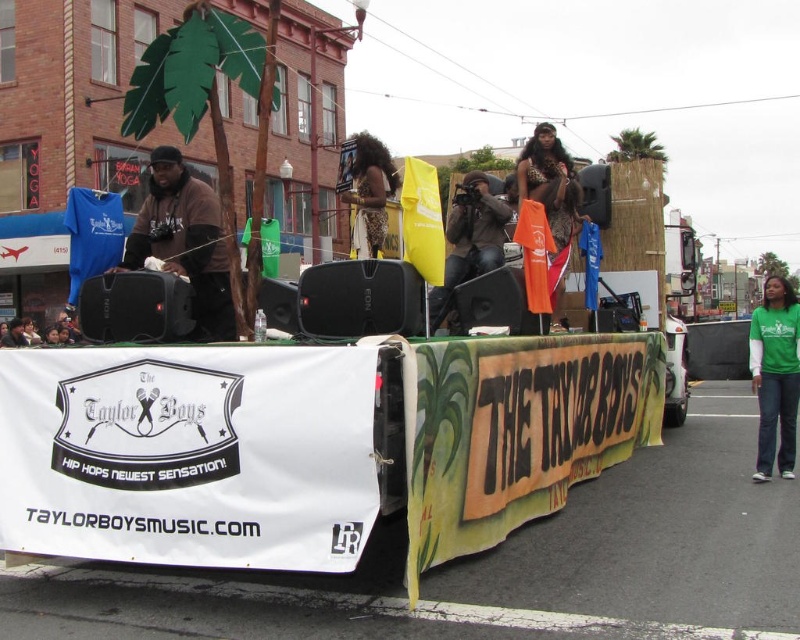
Question: Is green cotton shirt at lower right behind matte black camera at center?

Choices:
 (A) no
 (B) yes

Answer: (B)

Question: Does brown matte/black textured jacket at left appear on the right side of leopard print dress at center?

Choices:
 (A) no
 (B) yes

Answer: (B)

Question: Does brown matte/black textured jacket at left come in front of leather jacket at upper center?

Choices:
 (A) no
 (B) yes

Answer: (B)

Question: Estimate the real-world distances between objects in this image. Which object is farther from the green cotton shirt at lower right?

Choices:
 (A) brown matte/black textured jacket at left
 (B) leather jacket at upper center
 (C) matte black camera at center
 (D) leopard print dress at center

Answer: (A)

Question: Which of the following is the closest to the observer?

Choices:
 (A) brown matte/black textured jacket at left
 (B) leopard print dress at center
 (C) matte black camera at center

Answer: (A)

Question: Which point is closer to the camera taking this photo?

Choices:
 (A) (766, 358)
 (B) (558, 170)
 (C) (370, 148)

Answer: (A)